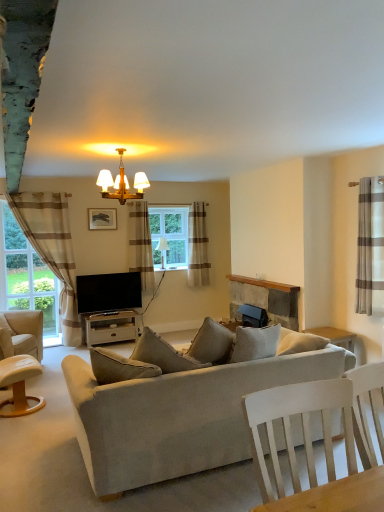
Question: Is brown striped curtain at center, the 2th curtain viewed from the left, further to camera compared to beige striped curtain at right, which is the 4th curtain in back-to-front order?

Choices:
 (A) yes
 (B) no

Answer: (A)

Question: Is brown striped curtain at center, acting as the 3th curtain starting from the right, touching beige striped curtain at right, marked as the 1th curtain in a right-to-left arrangement?

Choices:
 (A) no
 (B) yes

Answer: (A)

Question: Is brown striped curtain at center, which appears as the 2th curtain when viewed from the back, at the left side of beige striped curtain at right, the first curtain viewed from the front?

Choices:
 (A) yes
 (B) no

Answer: (A)

Question: From the image's perspective, is brown striped curtain at center, acting as the 3th curtain starting from the right, below beige striped curtain at right, which is the 4th curtain in back-to-front order?

Choices:
 (A) yes
 (B) no

Answer: (B)

Question: Is the depth of brown striped curtain at center, the third curtain from the front, less than that of beige striped curtain at right, positioned as the 4th curtain in left-to-right order?

Choices:
 (A) no
 (B) yes

Answer: (A)

Question: Is beige striped curtain at center, placed as the 3th curtain when sorted from left to right, spatially inside brown striped curtain at center, the third curtain from the front, or outside of it?

Choices:
 (A) outside
 (B) inside

Answer: (A)

Question: From a real-world perspective, relative to brown striped curtain at center, which appears as the 2th curtain when viewed from the back, is beige striped curtain at center, marked as the second curtain in a right-to-left arrangement, vertically above or below?

Choices:
 (A) below
 (B) above

Answer: (A)

Question: Is point (193, 279) closer or farther from the camera than point (147, 227)?

Choices:
 (A) farther
 (B) closer

Answer: (B)

Question: Looking at the image, does beige striped curtain at center, placed as the 3th curtain when sorted from left to right, seem bigger or smaller compared to brown striped curtain at center, which appears as the 2th curtain when viewed from the back?

Choices:
 (A) small
 (B) big

Answer: (A)

Question: Considering the positions of brown striped curtain at center, acting as the 3th curtain starting from the right, and rustic stone fireplace at center in the image, is brown striped curtain at center, acting as the 3th curtain starting from the right, taller or shorter than rustic stone fireplace at center?

Choices:
 (A) short
 (B) tall

Answer: (B)

Question: From a real-world perspective, is brown striped curtain at center, the third curtain from the front, above or below rustic stone fireplace at center?

Choices:
 (A) above
 (B) below

Answer: (A)

Question: Is brown striped curtain at center, which appears as the 2th curtain when viewed from the back, situated inside rustic stone fireplace at center or outside?

Choices:
 (A) inside
 (B) outside

Answer: (B)

Question: Considering the positions of brown striped curtain at center, which appears as the 2th curtain when viewed from the back, and rustic stone fireplace at center in the image, is brown striped curtain at center, which appears as the 2th curtain when viewed from the back, bigger or smaller than rustic stone fireplace at center?

Choices:
 (A) big
 (B) small

Answer: (A)

Question: From the image's perspective, is rustic stone fireplace at center located above or below beige fabric couch at center?

Choices:
 (A) above
 (B) below

Answer: (A)

Question: Is rustic stone fireplace at center wider or thinner than beige fabric couch at center?

Choices:
 (A) wide
 (B) thin

Answer: (B)